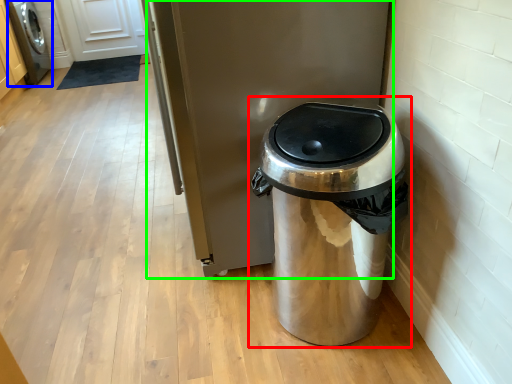
Question: Which object is the closest to the waste container (highlighted by a red box)? Choose among these: washing machine (highlighted by a blue box) or appliance (highlighted by a green box).

Choices:
 (A) washing machine
 (B) appliance

Answer: (B)